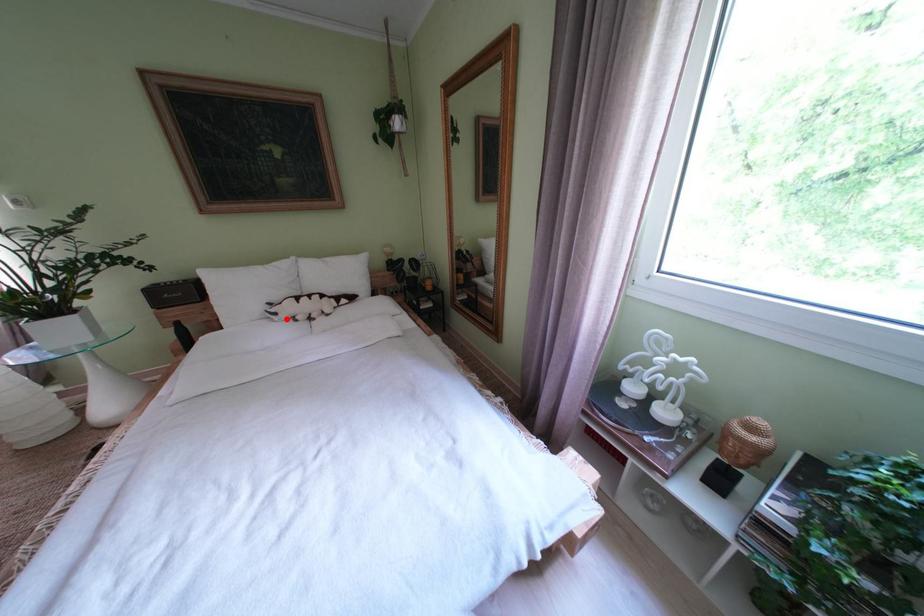
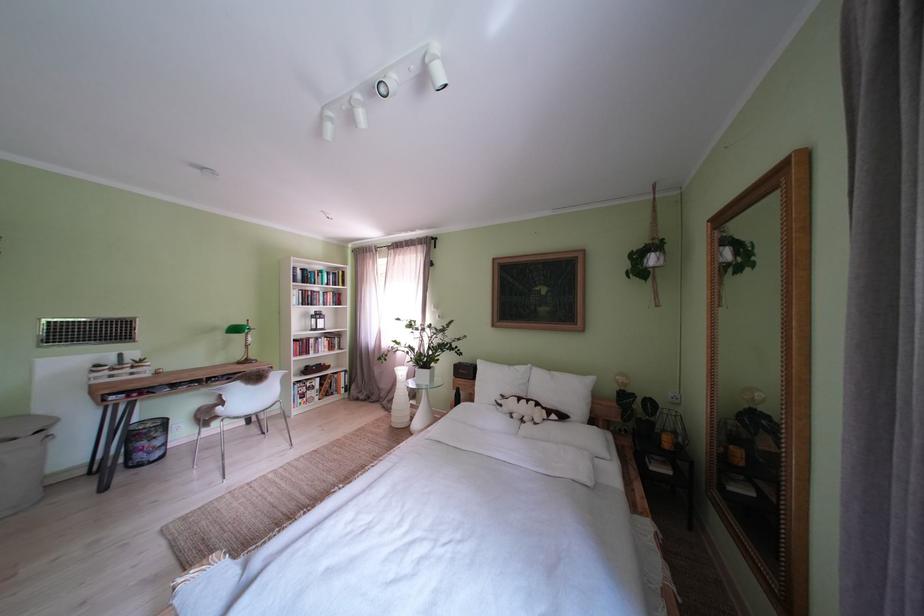
Question: I am providing you with two images of the same scene from different viewpoints. Given a red point in image1, look at the same physical point in image2. Is it:

Choices:
 (A) Closer to the viewpoint
 (B) Farther from the viewpoint

Answer: (B)